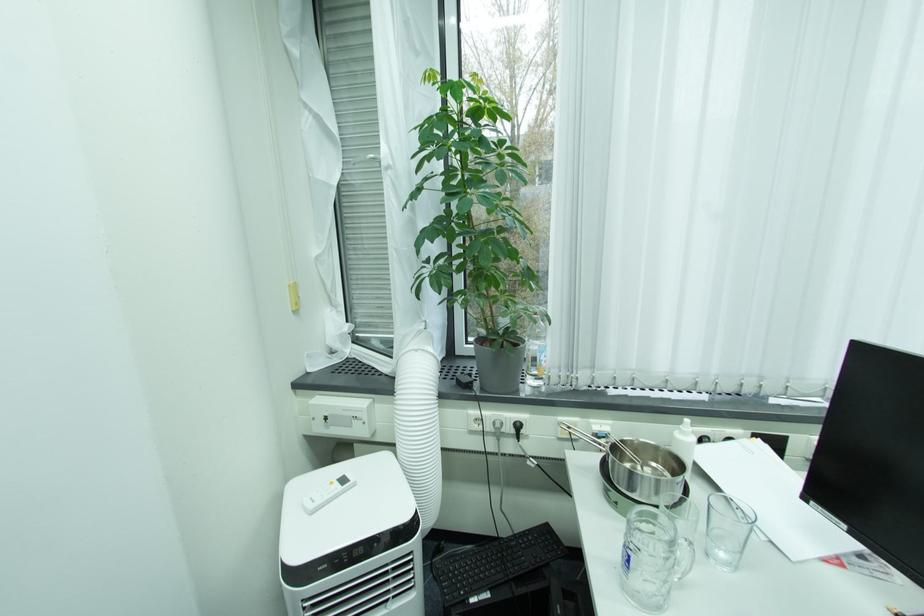
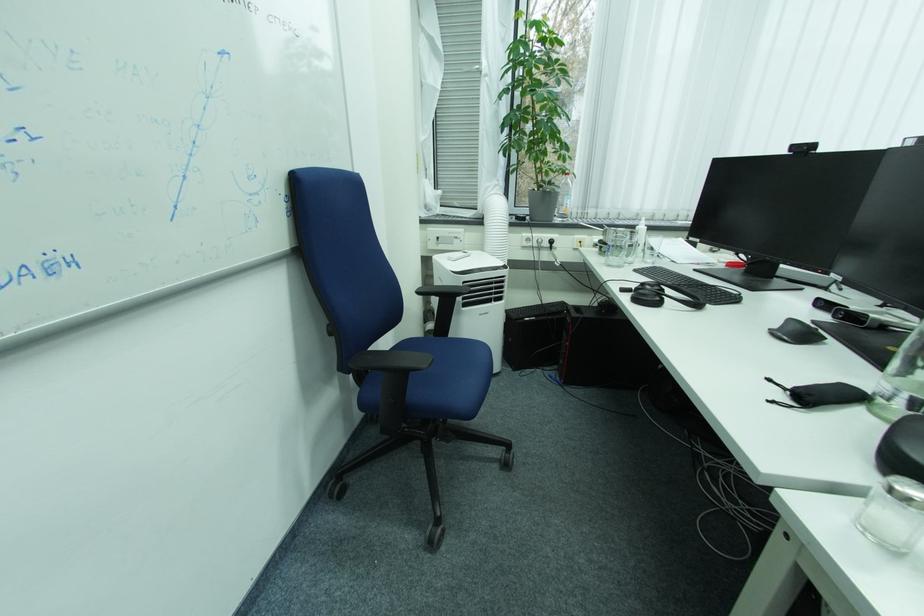
Looking at this image, in a continuous first-person perspective shot, in which direction is the camera moving?

The cameraman walked toward left, backward.